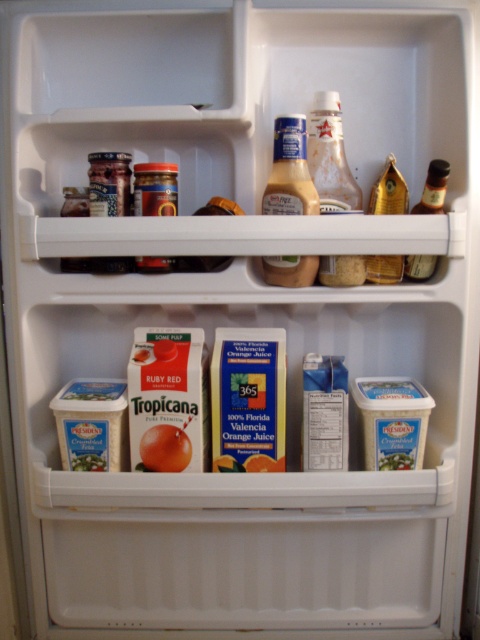
Question: Is translucent glass bottle at upper center positioned behind translucent glass bottle at upper right?

Choices:
 (A) no
 (B) yes

Answer: (B)

Question: Which object appears closest to the camera in this image?

Choices:
 (A) matte plastic mustard at center
 (B) translucent glass bottle at upper center
 (C) translucent glass bottle at upper right

Answer: (A)

Question: Which of these objects is positioned closest to the translucent glass bottle at upper center?

Choices:
 (A) translucent glass bottle at upper right
 (B) matte plastic mustard at center

Answer: (B)

Question: In this image, where is translucent glass bottle at upper center located relative to matte plastic mustard at center?

Choices:
 (A) above
 (B) below

Answer: (A)

Question: Which object appears farthest from the camera in this image?

Choices:
 (A) translucent glass bottle at upper center
 (B) matte plastic mustard at center
 (C) translucent glass bottle at upper right

Answer: (A)

Question: Is translucent glass bottle at upper center to the right of matte plastic mustard at center from the viewer's perspective?

Choices:
 (A) no
 (B) yes

Answer: (B)